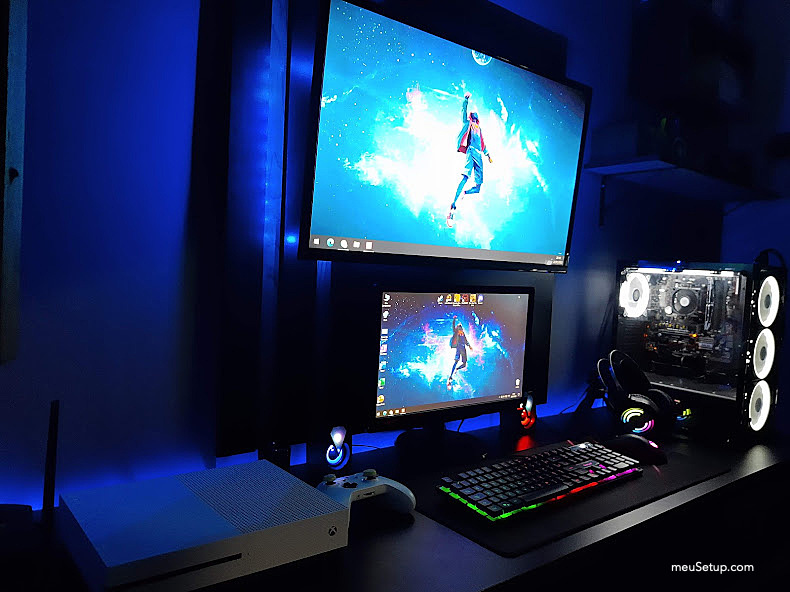
You are a GUI agent. You are given a task and a screenshot of the screen. Output one action in this format:
    pyautogui.click(x=<x>, y=<y>)
    Task: Click on the shelf
    This screenshot has width=790, height=592.
    Given the screenshot: What is the action you would take?
    pyautogui.click(x=642, y=166)